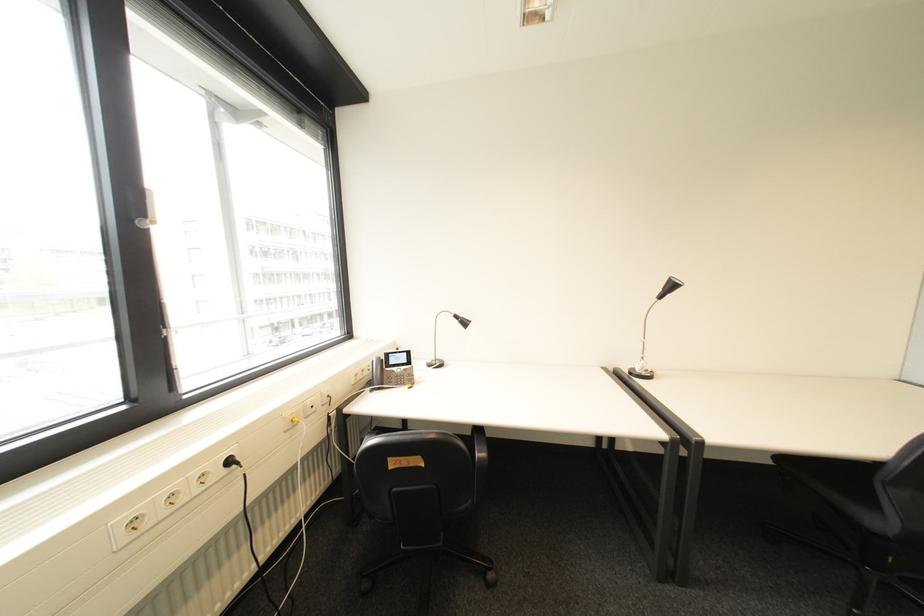
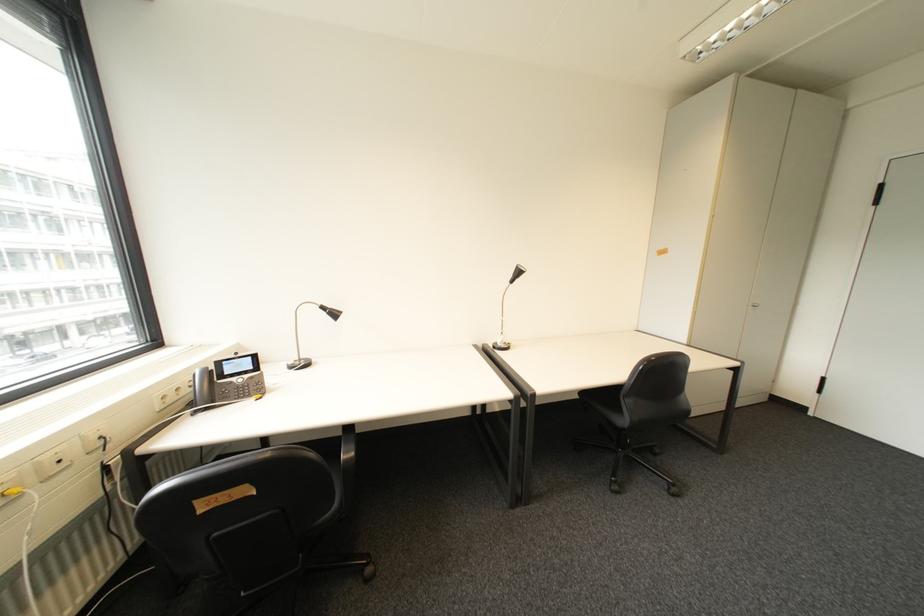
Question: The images are taken continuously from a first-person perspective. In which direction is your viewpoint rotating?

Choices:
 (A) Left
 (B) Right
 (C) Up
 (D) Down

Answer: (B)